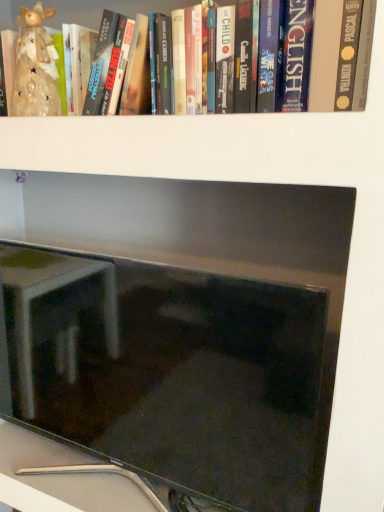
Question: From the image's perspective, is hardcover book at upper center above or below matte black monitor at center?

Choices:
 (A) below
 (B) above

Answer: (B)

Question: In the image, is hardcover book at upper center positioned in front of or behind matte black monitor at center?

Choices:
 (A) front
 (B) behind

Answer: (A)

Question: Which object is positioned farthest from the matte ceramic figurine at upper left?

Choices:
 (A) hardcover book at upper center
 (B) matte black monitor at center

Answer: (B)

Question: Considering the real-world distances, which object is farthest from the matte black monitor at center?

Choices:
 (A) hardcover book at upper center
 (B) matte ceramic figurine at upper left

Answer: (A)